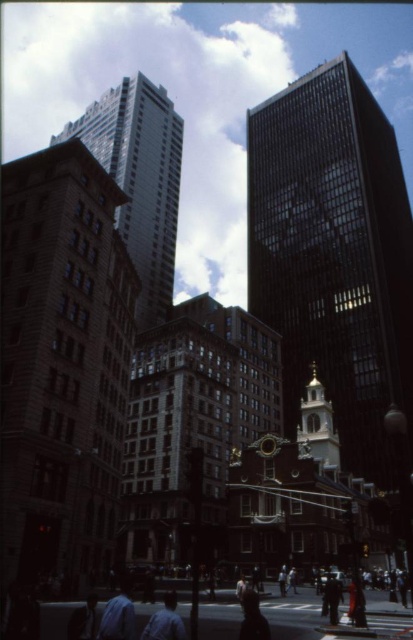
Question: Among these objects, which one is farthest from the camera?

Choices:
 (A) glassy reflective skyscraper at center
 (B) denim jacket at lower right
 (C) brown stone building at left

Answer: (A)

Question: Can you confirm if glassy reflective skyscraper at center is positioned below dark blue shirt at lower center?

Choices:
 (A) no
 (B) yes

Answer: (A)

Question: Which object is closer to the camera taking this photo?

Choices:
 (A) glassy reflective skyscraper at upper left
 (B) glassy reflective skyscraper at center
 (C) goldmaterial/texturetower at center

Answer: (C)

Question: Does brown stone building at left come behind glassy reflective skyscraper at upper left?

Choices:
 (A) yes
 (B) no

Answer: (B)

Question: Which object is positioned closest to the denim jacket at lower right?

Choices:
 (A) dark blue shirt at lower center
 (B) goldmaterial/texturetower at center
 (C) blue fabric shirt at lower left

Answer: (A)

Question: Can you confirm if denim jacket at lower right is positioned to the right of dark blue shirt at lower center?

Choices:
 (A) yes
 (B) no

Answer: (B)